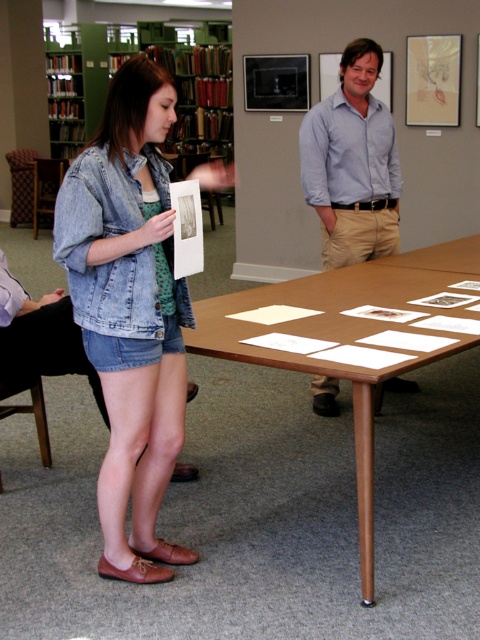
You are standing in the library and see a young woman wearing both a denim jacket at center and a light blue shirt at center. Which piece of clothing is visible closer to you?

The denim jacket at center is closer to the viewer than the light blue shirt at center, so the denim jacket at center is visible closer to you.

You are standing in the library and want to reach the point marked as point (370, 157). If your walking speed is 3 feet per second, how many seconds will it take you to reach that point?

The distance between you and point (370, 157) is 11.87 feet. At a speed of 3 feet per second, it will take approximately 3.96 seconds to reach the point.

You are trying to decide which clothing item to take with you from the scene. The denim jacket at center and the light blue shirt at center are both on the table. Which one has a smaller width?

The denim jacket at center has a smaller width than the light blue shirt at center according to the description.